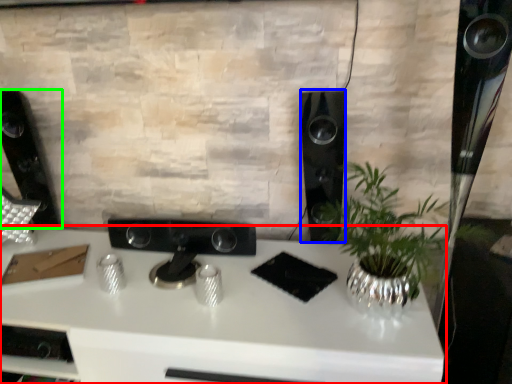
Question: Based on their relative distances, which object is nearer to desk (highlighted by a red box)? Choose from speaker (highlighted by a blue box) and speaker (highlighted by a green box).

Choices:
 (A) speaker
 (B) speaker

Answer: (A)